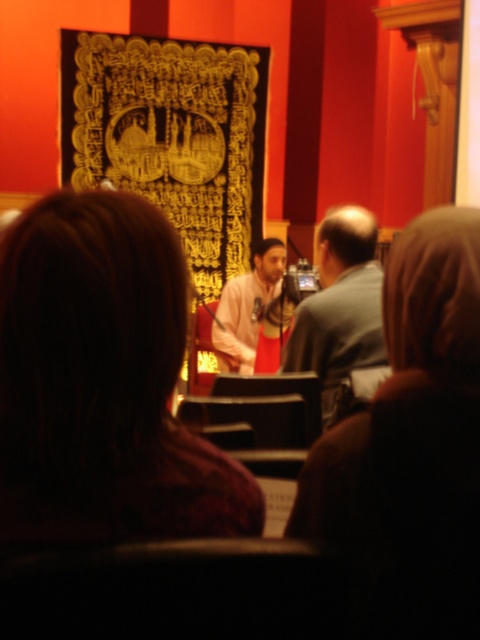
Question: Is dark brown hair at center above pink fabric at center?

Choices:
 (A) yes
 (B) no

Answer: (B)

Question: Observing the image, what is the correct spatial positioning of dark brown hair at center in reference to pink fabric at center?

Choices:
 (A) right
 (B) left

Answer: (B)

Question: Which is nearer to the dark brown hair at center?

Choices:
 (A) pink fabric at center
 (B) gray fabric shirt at center

Answer: (B)

Question: Which object is the farthest from the pink fabric at center?

Choices:
 (A) dark brown hair at center
 (B) gray fabric shirt at center
 (C) brown fabric headscarf at center

Answer: (A)

Question: Among these objects, which one is farthest from the camera?

Choices:
 (A) gray fabric shirt at center
 (B) brown fabric headscarf at center
 (C) pink fabric at center

Answer: (C)

Question: Does dark brown hair at center have a greater width compared to brown fabric headscarf at center?

Choices:
 (A) yes
 (B) no

Answer: (A)